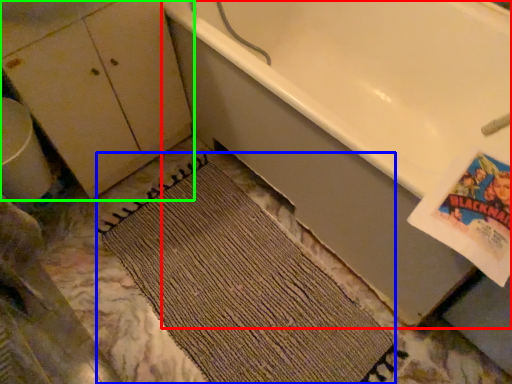
Question: Based on their relative distances, which object is farther from bathtub (highlighted by a red box)? Choose from doormat (highlighted by a blue box) and dresser (highlighted by a green box).

Choices:
 (A) doormat
 (B) dresser

Answer: (B)